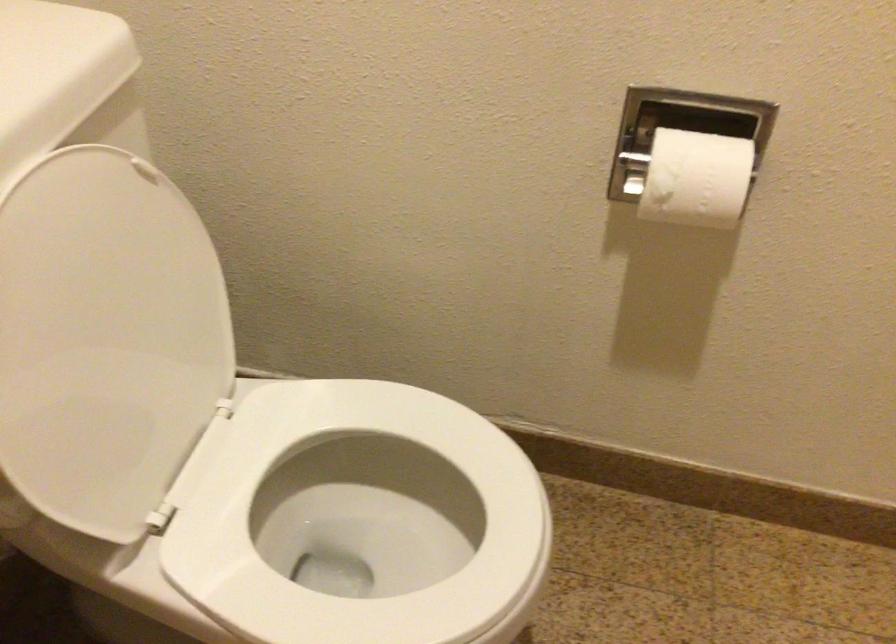
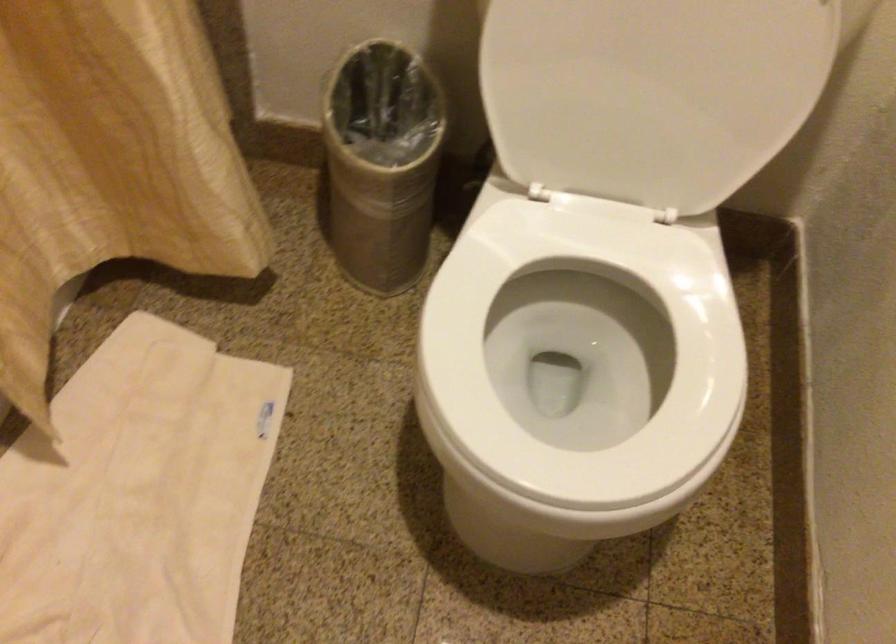
How did the camera likely rotate?

The camera's rotation is toward left-down.